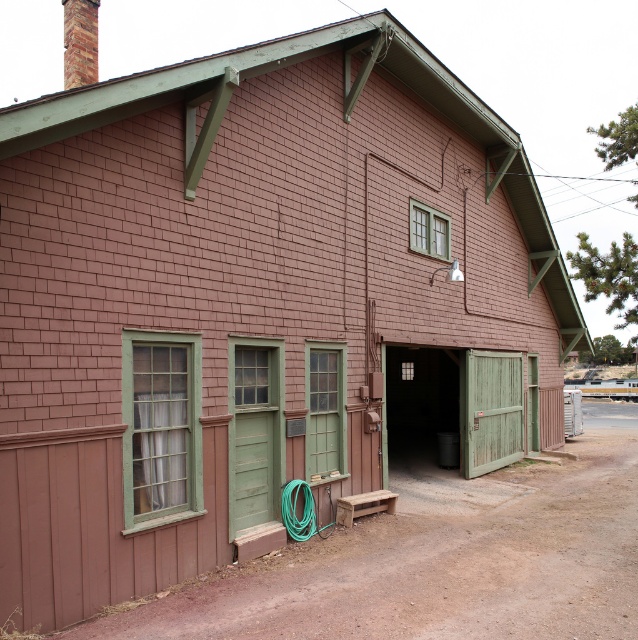
Is point (475, 352) farther from viewer compared to point (329, 532)?

Yes.

Between green wood/glass garage door at lower right and green rubber hose at center, which one has more height?

green wood/glass garage door at lower right is taller.

Does point (505, 388) come behind point (283, 506)?

Yes, it is.

You are a GUI agent. You are given a task and a screenshot of the screen. Output one action in this format:
    pyautogui.click(x=<x>, y=<y>)
    Task: Click on the green wood/glass garage door at lower right
    This screenshot has height=640, width=638.
    Given the screenshot: What is the action you would take?
    pyautogui.click(x=491, y=410)

Is green wooden door at center positioned in front of green rubber hose at center?

That is False.

Is point (456, 388) positioned after point (327, 525)?

That is True.

The width and height of the screenshot is (638, 640). In order to click on green wooden door at center in this screenshot , I will do `click(461, 401)`.

This screenshot has height=640, width=638. I want to click on green wooden door at center, so click(x=461, y=401).

Between point (505, 417) and point (477, 387), which one is positioned behind?

The point (505, 417) is behind.

The height and width of the screenshot is (640, 638). Describe the element at coordinates (461, 401) in the screenshot. I see `green wooden door at center` at that location.

Between point (478, 396) and point (517, 435), which one is positioned in front?

Point (478, 396) is in front.

Where is `green wooden door at center`? green wooden door at center is located at coordinates (461, 401).